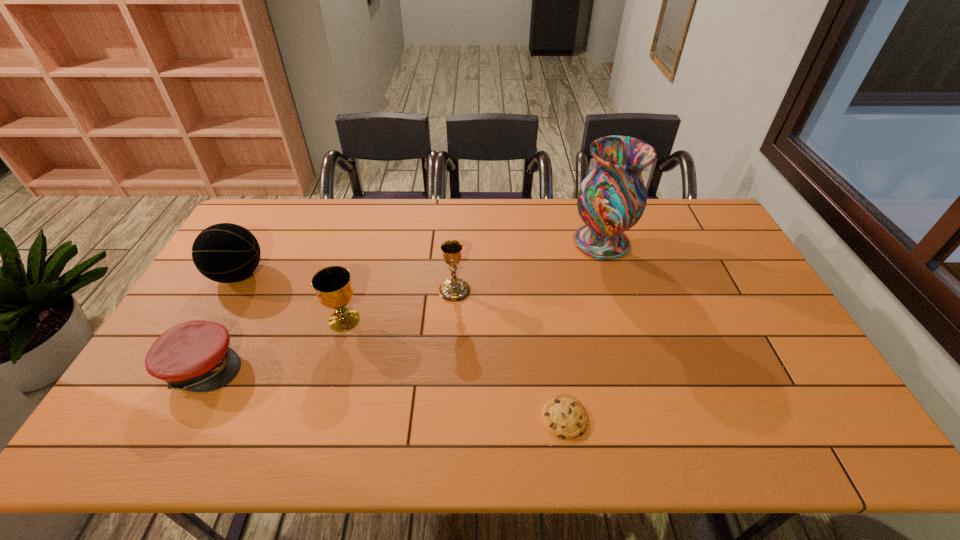
This screenshot has width=960, height=540. I want to click on vase, so click(x=612, y=198).

Find the location of a particular element. This screenshot has width=960, height=540. the rightmost object is located at coordinates (612, 198).

The height and width of the screenshot is (540, 960). I want to click on basketball, so click(226, 253).

Identify the location of the third object from right to left. (453, 289).

Find the location of `the right chalice`. the right chalice is located at coordinates (453, 289).

Find the location of `the nearer chalice`. the nearer chalice is located at coordinates (332, 284).

Identify the location of the left chalice. (332, 284).

Where is `cap`? cap is located at coordinates (194, 356).

Where is `the shortest object`? Image resolution: width=960 pixels, height=540 pixels. the shortest object is located at coordinates (563, 416).

Where is `cookie`? Image resolution: width=960 pixels, height=540 pixels. cookie is located at coordinates (563, 416).